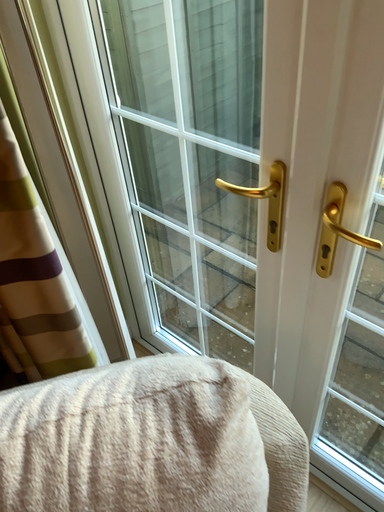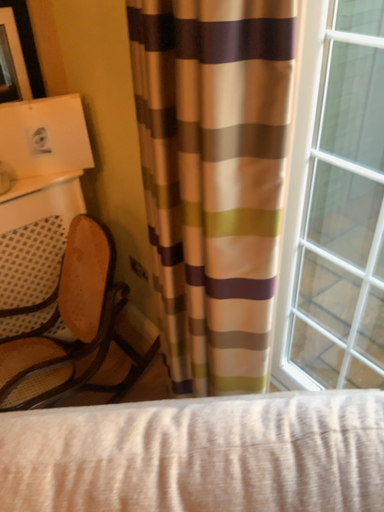
Question: Which way did the camera rotate in the video?

Choices:
 (A) rotated right
 (B) rotated left

Answer: (B)